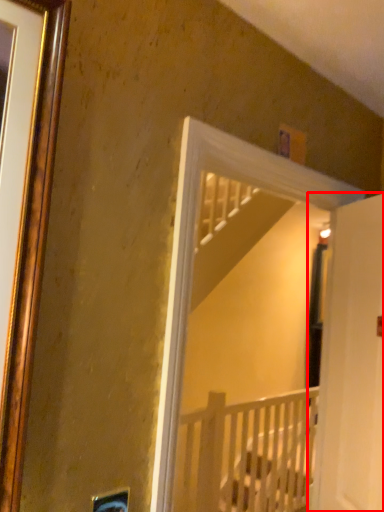
Question: In this image, where is door (annotated by the red box) located relative to infant bed?

Choices:
 (A) right
 (B) left

Answer: (A)